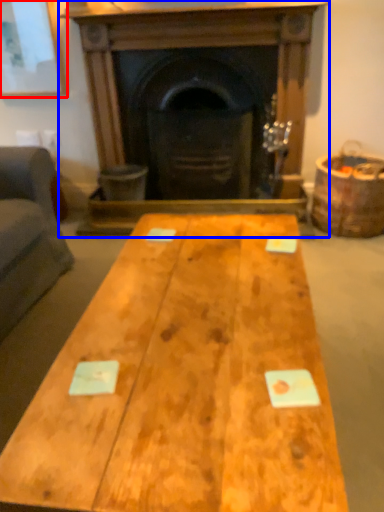
Question: Among these objects, which one is farthest to the camera, picture frame (highlighted by a red box) or fireplace (highlighted by a blue box)?

Choices:
 (A) picture frame
 (B) fireplace

Answer: (A)